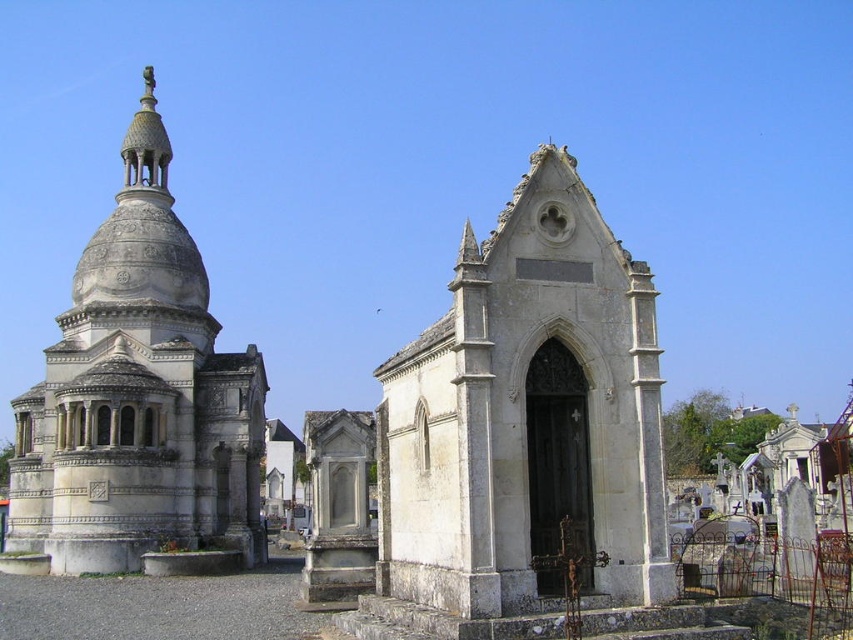
You are an architect designing a new garden path that needs to pass between the white stone chapel at center and the white stone dome at left. The path must be at least 2 meters wide to accommodate visitors. Based on the scene description, can the path be safely placed between them?

The white stone chapel at center is narrower than the white stone dome at left. However, the exact width of the space between them isn not specified in the objects description. The answer cannot be determined with the given information.

You are standing at the entrance of the cemetery and want to locate the white stone chapel at center. According to the coordinates provided, where should you look relative to your current position?

The white stone chapel at center is located at coordinates point (527, 417), which means it is positioned to the right and slightly below your current viewpoint.